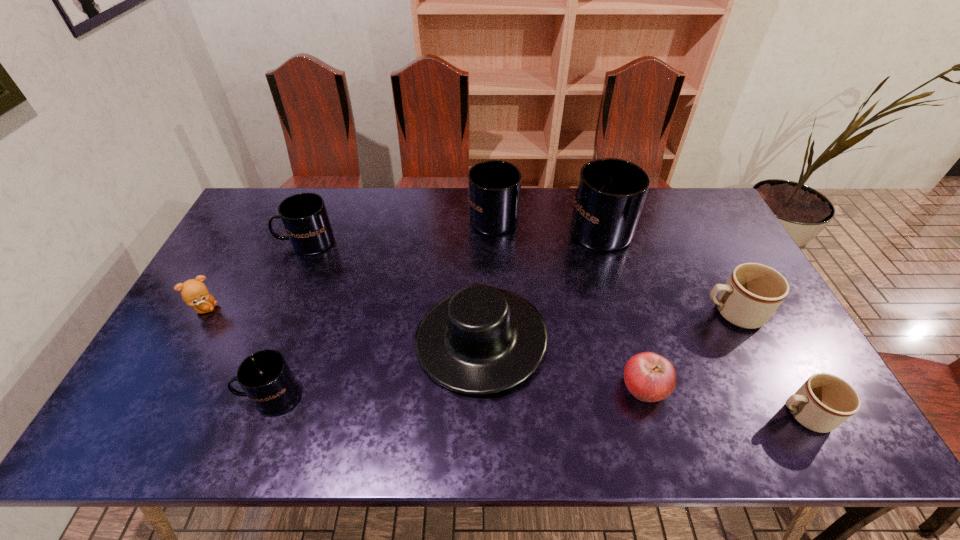
Where is `vacant region between the third biggest black mug and the bigger brown mug`? Image resolution: width=960 pixels, height=540 pixels. vacant region between the third biggest black mug and the bigger brown mug is located at coordinates (519, 278).

Identify which object is the second nearest to the third black mug from left to right. Please provide its 2D coordinates. Your answer should be formatted as a tuple, i.e. [(x, y)], where the tuple contains the x and y coordinates of a point satisfying the conditions above.

[(480, 340)]

Find the location of a particular element. object that is the fifth nearest to the black dress hat is located at coordinates (x=304, y=216).

The width and height of the screenshot is (960, 540). In order to click on mug object that ranks as the fourth closest to the nearest black mug in this screenshot , I will do `click(753, 292)`.

This screenshot has height=540, width=960. I want to click on mug that is the closest to the biggest black mug, so click(494, 187).

Locate an element on the screen. The image size is (960, 540). black mug that stands as the second closest to the third biggest black mug is located at coordinates (494, 187).

Point out which black mug is positioned as the nearest to the rightmost black mug. Please provide its 2D coordinates. Your answer should be formatted as a tuple, i.e. [(x, y)], where the tuple contains the x and y coordinates of a point satisfying the conditions above.

[(494, 187)]

The width and height of the screenshot is (960, 540). I want to click on vacant space that satisfies the following two spatial constraints: 1. on the face of the teddy bear; 2. on the right side of the black dress hat, so click(188, 339).

Locate an element on the screen. This screenshot has height=540, width=960. free spot that satisfies the following two spatial constraints: 1. with the handle on the side of the smallest black mug; 2. on the side of the smaller brown mug with the handle is located at coordinates (262, 415).